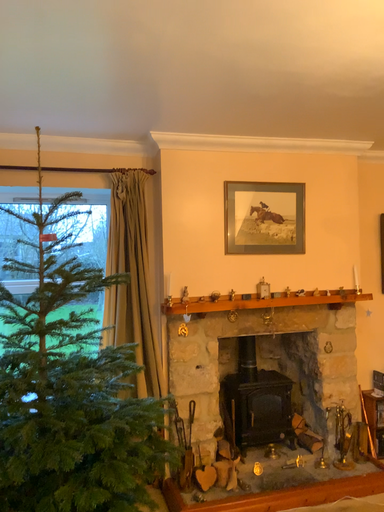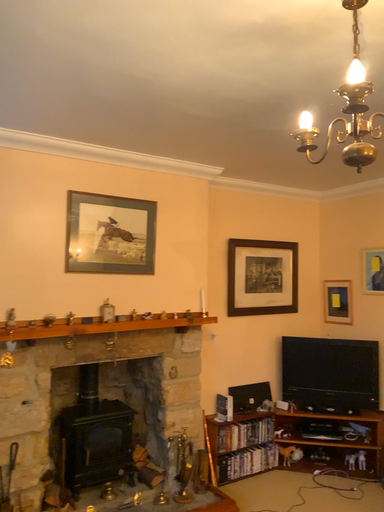
Question: How did the camera likely rotate when shooting the video?

Choices:
 (A) rotated left
 (B) rotated right

Answer: (B)